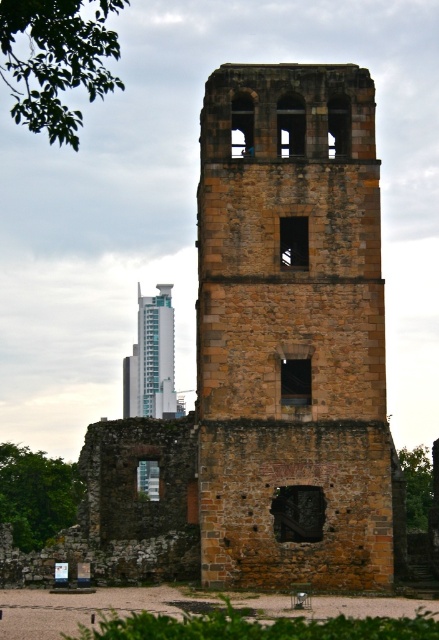
Between point (377, 298) and point (169, 321), which one is positioned in front?

Point (377, 298) is more forward.

Based on the photo, does brown stone tower at center appear on the left side of teal glass skyscraper at center?

No, brown stone tower at center is not to the left of teal glass skyscraper at center.

Describe the element at coordinates (291, 332) in the screenshot. I see `brown stone tower at center` at that location.

Locate an element on the screen. This screenshot has height=640, width=439. brown stone tower at center is located at coordinates (291, 332).

Is point (61, 4) positioned behind point (141, 384)?

No, (61, 4) is closer to viewer.

The height and width of the screenshot is (640, 439). In order to click on green leafy tree at upper left in this screenshot , I will do `click(57, 60)`.

Between brown stone tower at center and green leafy tree at upper left, which one is positioned lower?

brown stone tower at center is below.

Identify the location of brown stone tower at center. (291, 332).

You are a GUI agent. You are given a task and a screenshot of the screen. Output one action in this format:
    pyautogui.click(x=<x>, y=<y>)
    Task: Click on the brown stone tower at center
    The width and height of the screenshot is (439, 640).
    Given the screenshot: What is the action you would take?
    click(x=291, y=332)